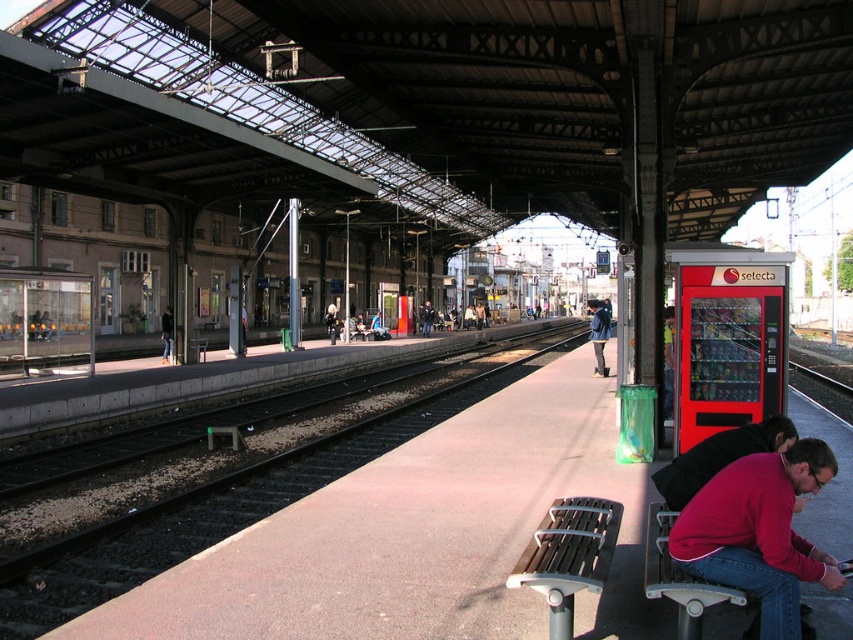
Question: Can you confirm if black asphalt train track at center is bigger than dark blue jacket at center?

Choices:
 (A) no
 (B) yes

Answer: (A)

Question: Which point is farther from the camera taking this photo?

Choices:
 (A) (166, 349)
 (B) (554, 504)
 (C) (769, 595)

Answer: (A)

Question: Is red sweater at lower right closer to camera compared to dark blue jeans at left?

Choices:
 (A) no
 (B) yes

Answer: (B)

Question: Which of the following is the farthest from the observer?

Choices:
 (A) metallic gray bench at lower center
 (B) black asphalt train track at center

Answer: (B)

Question: Is black asphalt train track at center bigger than metallic silver bench at lower right?

Choices:
 (A) no
 (B) yes

Answer: (B)

Question: Which point is closer to the camera?

Choices:
 (A) dark blue jacket at center
 (B) metallic gray bench at lower center
 (C) black asphalt train track at center
 (D) red sweater at lower right

Answer: (B)